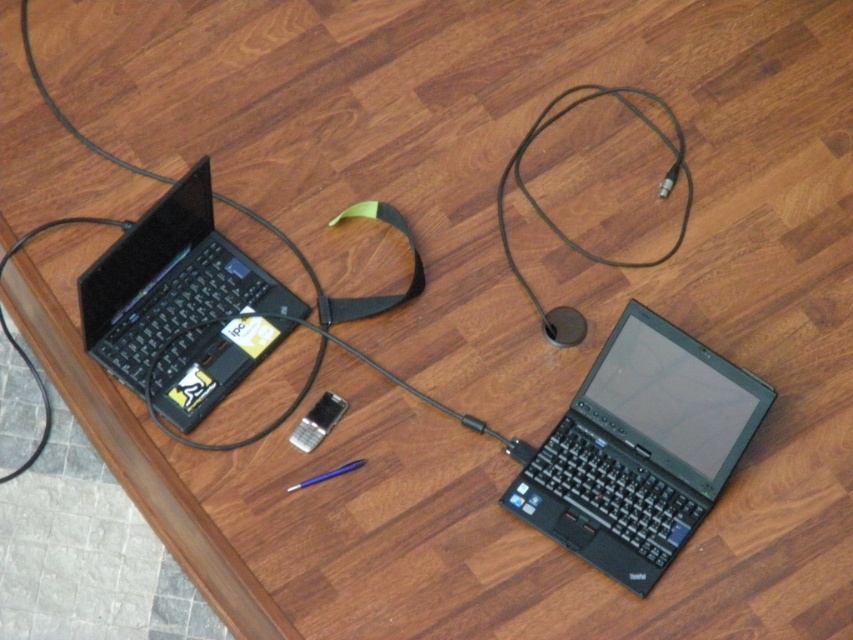
Question: Which point is closer to the camera?

Choices:
 (A) black matte laptop at lower right
 (B) black matte laptop at left

Answer: (B)

Question: Which of the following is the closest to the observer?

Choices:
 (A) black matte laptop at left
 (B) black matte laptop at lower right

Answer: (A)

Question: Among these points, which one is nearest to the camera?

Choices:
 (A) (769, 387)
 (B) (271, 310)

Answer: (A)

Question: Where is black matte laptop at lower right located in relation to black matte laptop at left in the image?

Choices:
 (A) below
 (B) above

Answer: (A)

Question: Is black matte laptop at lower right behind black matte laptop at left?

Choices:
 (A) yes
 (B) no

Answer: (A)

Question: From the image, what is the correct spatial relationship of black matte laptop at lower right in relation to black matte laptop at left?

Choices:
 (A) above
 (B) below

Answer: (B)